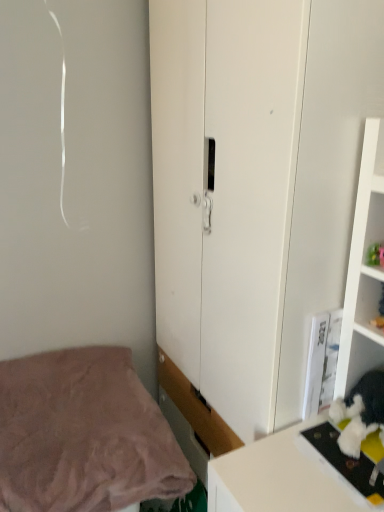
Question: In the image, is white matte cupboard at center positioned in front of or behind pink soft fabric bed at lower left?

Choices:
 (A) front
 (B) behind

Answer: (A)

Question: From a real-world perspective, is white matte cupboard at center positioned above or below pink soft fabric bed at lower left?

Choices:
 (A) below
 (B) above

Answer: (B)

Question: Which is correct: white matte cupboard at center is inside pink soft fabric bed at lower left, or outside of it?

Choices:
 (A) outside
 (B) inside

Answer: (A)

Question: From their relative heights in the image, would you say pink soft fabric bed at lower left is taller or shorter than white matte cupboard at center?

Choices:
 (A) tall
 (B) short

Answer: (B)

Question: Relative to white matte cupboard at center, is pink soft fabric bed at lower left in front or behind?

Choices:
 (A) front
 (B) behind

Answer: (B)

Question: Is point (77, 444) positioned closer to the camera than point (215, 32)?

Choices:
 (A) closer
 (B) farther

Answer: (B)

Question: Looking at their shapes, would you say pink soft fabric bed at lower left is wider or thinner than white matte cupboard at center?

Choices:
 (A) wide
 (B) thin

Answer: (A)